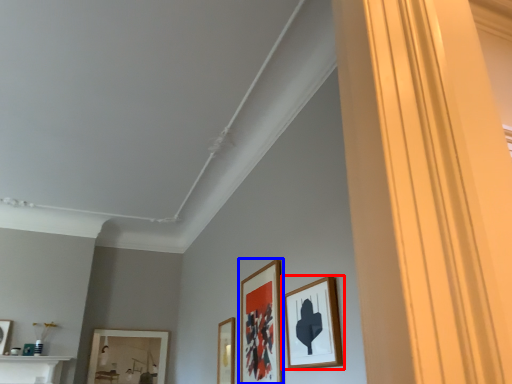
Question: Which of the following is the closest to the observer, picture frame (highlighted by a red box) or picture frame (highlighted by a blue box)?

Choices:
 (A) picture frame
 (B) picture frame

Answer: (A)